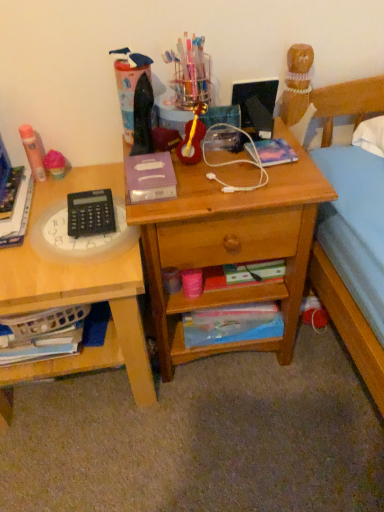
Where is `hardcover book at left`? The height and width of the screenshot is (512, 384). hardcover book at left is located at coordinates (18, 214).

This screenshot has height=512, width=384. What do you see at coordinates (33, 151) in the screenshot?
I see `matte orange glue stick at left, which is the 3th stationery from right to left` at bounding box center [33, 151].

The height and width of the screenshot is (512, 384). Find the location of `wooden desk at center`. wooden desk at center is located at coordinates (230, 244).

Considering the positions of objects metallic silver pen at upper center, acting as the 1th stationery starting from the right, and multicolored fabric book at center, arranged as the 3th paperback book when ordered from the bottom, in the image provided, who is behind, metallic silver pen at upper center, acting as the 1th stationery starting from the right, or multicolored fabric book at center, arranged as the 3th paperback book when ordered from the bottom,?

Positioned behind is multicolored fabric book at center, arranged as the 3th paperback book when ordered from the bottom.

From the image's perspective, is metallic silver pen at upper center, acting as the 3th stationery starting from the left, located beneath multicolored fabric book at center, arranged as the 3th paperback book when ordered from the bottom?

No, from the image's perspective, metallic silver pen at upper center, acting as the 3th stationery starting from the left, is not below multicolored fabric book at center, arranged as the 3th paperback book when ordered from the bottom.

Does point (116, 78) appear closer or farther from the camera than point (254, 143)?

Clearly, point (116, 78) is more distant from the camera than point (254, 143).

From a real-world perspective, which is physically above, metallic silver pen at upper center, acting as the 1th stationery starting from the right, or multicolored fabric book at center, which ranks as the 2th paperback book in front-to-back order?

metallic silver pen at upper center, acting as the 1th stationery starting from the right.

From the picture: Could you measure the distance between pink fluffy ball at left, which is the second stationery from left to right, and hardcover book at left?

A distance of 5.74 inches exists between pink fluffy ball at left, which is the second stationery from left to right, and hardcover book at left.

From the image's perspective, between pink fluffy ball at left, which is the second stationery in right-to-left order, and hardcover book at left, who is located below?

hardcover book at left.

Is pink fluffy ball at left, which is the second stationery in right-to-left order, at the right side of hardcover book at left?

Yes, pink fluffy ball at left, which is the second stationery in right-to-left order, is to the right of hardcover book at left.

From a real-world perspective, is matte blue paperback book at lower center, marked as the first paperback book in a back-to-front arrangement, positioned under purple matte paperback book at center, the 3th paperback book when ordered from back to front, based on gravity?

Yes.

Does point (210, 309) come farther from viewer compared to point (141, 170)?

Yes, point (210, 309) is farther from viewer.

Is matte blue paperback book at lower center, marked as the first paperback book in a bottom-to-top arrangement, to the left or to the right of purple matte paperback book at center, which appears as the 2th paperback book when viewed from the top, in the image?

matte blue paperback book at lower center, marked as the first paperback book in a bottom-to-top arrangement, is positioned on purple matte paperback book at center, which appears as the 2th paperback book when viewed from the top,'s right side.

Which of these two, matte blue paperback book at lower center, marked as the first paperback book in a back-to-front arrangement, or purple matte paperback book at center, positioned as the first paperback book in front-to-back order, is wider?

purple matte paperback book at center, positioned as the first paperback book in front-to-back order.

In the scene shown: Can you see wooden desk at left touching purple matte paperback book at center, arranged as the 2th paperback book when ordered from the bottom?

There is a gap between wooden desk at left and purple matte paperback book at center, arranged as the 2th paperback book when ordered from the bottom.

Consider the image. Is wooden desk at left to the left or to the right of purple matte paperback book at center, positioned as the first paperback book in front-to-back order, in the image?

From the image, it's evident that wooden desk at left is to the left of purple matte paperback book at center, positioned as the first paperback book in front-to-back order.

Find the location of a particular element. The width and height of the screenshot is (384, 512). paperback book that is the 1st object to the right of the wooden desk at left, starting at the anchor is located at coordinates tap(150, 177).

In the scene shown: Does hardcover book at left have a smaller size compared to wooden desk at center?

Yes, hardcover book at left is smaller than wooden desk at center.

Is hardcover book at left turned away from wooden desk at center?

No, hardcover book at left is not facing away from wooden desk at center.

From the image's perspective, between hardcover book at left and wooden desk at center, which one is located above?

From the image's view, hardcover book at left is above.

Considering the sizes of objects hardcover book at left and wooden desk at center in the image provided, who is thinner, hardcover book at left or wooden desk at center?

hardcover book at left is thinner.

Is the surface of multicolored fabric book at center, arranged as the 3th paperback book when ordered from the bottom, in direct contact with wooden desk at left?

A: multicolored fabric book at center, arranged as the 3th paperback book when ordered from the bottom, and wooden desk at left are not in contact.

Considering the positions of points (279, 146) and (15, 268), is point (279, 146) farther from camera compared to point (15, 268)?

Yes, it is.

From the image's perspective, is multicolored fabric book at center, acting as the second paperback book starting from the back, located above or below wooden desk at left?

multicolored fabric book at center, acting as the second paperback book starting from the back, is above wooden desk at left.

Is multicolored fabric book at center, the 1th paperback book positioned from the top, inside the boundaries of wooden desk at left, or outside?

multicolored fabric book at center, the 1th paperback book positioned from the top, is outside wooden desk at left.

Is multicolored fabric book at center, acting as the second paperback book starting from the back, facing towards metallic silver pen at upper center, acting as the 3th stationery starting from the left?

No.

From a real-world perspective, is multicolored fabric book at center, arranged as the 3th paperback book when ordered from the bottom, located beneath metallic silver pen at upper center, acting as the 3th stationery starting from the left?

Indeed, from a real-world perspective, multicolored fabric book at center, arranged as the 3th paperback book when ordered from the bottom, is positioned beneath metallic silver pen at upper center, acting as the 3th stationery starting from the left.

How many degrees apart are the facing directions of multicolored fabric book at center, acting as the second paperback book starting from the back, and metallic silver pen at upper center, acting as the 1th stationery starting from the right?

2.74 degrees.

Is multicolored fabric book at center, acting as the second paperback book starting from the back, in front of or behind metallic silver pen at upper center, acting as the 1th stationery starting from the right, in the image?

In the image, multicolored fabric book at center, acting as the second paperback book starting from the back, appears behind metallic silver pen at upper center, acting as the 1th stationery starting from the right.

In order to click on the 1st paperback book behind the metallic silver pen at upper center, acting as the 1th stationery starting from the right in this screenshot , I will do `click(275, 152)`.

Find the location of a particular element. book below the pink fluffy ball at left, which is the second stationery in right-to-left order (from a real-world perspective) is located at coordinates (18, 214).

Looking at the image, which one is located closer to wooden desk at left, metallic silver pen at upper center, acting as the 3th stationery starting from the left, or matte orange glue stick at left, marked as the first stationery in a left-to-right arrangement?

matte orange glue stick at left, marked as the first stationery in a left-to-right arrangement, is closer to wooden desk at left.

Looking at the image, which one is located further to shiny black laptop at upper center, purple matte paperback book at center, which appears as the 2th paperback book when viewed from the top, or matte blue paperback book at lower center, marked as the first paperback book in a back-to-front arrangement?

matte blue paperback book at lower center, marked as the first paperback book in a back-to-front arrangement, lies further to shiny black laptop at upper center than the other object.

Estimate the real-world distances between objects in this image. Which object is further from black plastic calculator at left, metallic silver pen at upper center, acting as the 3th stationery starting from the left, or hardcover book at left?

metallic silver pen at upper center, acting as the 3th stationery starting from the left, is positioned further to the anchor black plastic calculator at left.

Which object lies further to the anchor point wooden desk at center, white matte earphones at center or shiny black laptop at upper center?

Among the two, shiny black laptop at upper center is located further to wooden desk at center.

Looking at the image, which one is located further to multicolored fabric book at center, arranged as the 3th paperback book when ordered from the bottom, matte orange glue stick at left, marked as the first stationery in a left-to-right arrangement, or purple matte paperback book at center, positioned as the first paperback book in front-to-back order?

Among the two, matte orange glue stick at left, marked as the first stationery in a left-to-right arrangement, is located further to multicolored fabric book at center, arranged as the 3th paperback book when ordered from the bottom.

Considering their positions, is metallic silver pen at upper center, acting as the 1th stationery starting from the right, positioned further to matte orange glue stick at left, which is the 3th stationery from right to left, than shiny black laptop at upper center?

The object further to matte orange glue stick at left, which is the 3th stationery from right to left, is shiny black laptop at upper center.

Based on their spatial positions, is wooden desk at left or matte blue paperback book at lower center, marked as the first paperback book in a bottom-to-top arrangement, further from wooden desk at center?

wooden desk at left is further to wooden desk at center.

Looking at the image, which one is located further to multicolored fabric book at center, which ranks as the 2th paperback book in front-to-back order, black plastic calculator at left or purple matte paperback book at center, which appears as the 2th paperback book when viewed from the top?

The object further to multicolored fabric book at center, which ranks as the 2th paperback book in front-to-back order, is black plastic calculator at left.

Where is `laptop situated between pink fluffy ball at left, which is the second stationery in right-to-left order, and multicolored fabric book at center, acting as the second paperback book starting from the back, from left to right`? Image resolution: width=384 pixels, height=512 pixels. laptop situated between pink fluffy ball at left, which is the second stationery in right-to-left order, and multicolored fabric book at center, acting as the second paperback book starting from the back, from left to right is located at coordinates (256, 105).

Find the location of `laptop between metallic silver pen at upper center, acting as the 1th stationery starting from the right, and multicolored fabric book at center, the 1th paperback book positioned from the top, in the horizontal direction`. laptop between metallic silver pen at upper center, acting as the 1th stationery starting from the right, and multicolored fabric book at center, the 1th paperback book positioned from the top, in the horizontal direction is located at coordinates (256, 105).

Locate an element on the screen. This screenshot has height=512, width=384. desk located between pink fluffy ball at left, which is the second stationery in right-to-left order, and white matte earphones at center in the left-right direction is located at coordinates (230, 244).

Where is `book between matte orange glue stick at left, marked as the first stationery in a left-to-right arrangement, and wooden desk at left in the up-down direction`? This screenshot has height=512, width=384. book between matte orange glue stick at left, marked as the first stationery in a left-to-right arrangement, and wooden desk at left in the up-down direction is located at coordinates (18, 214).